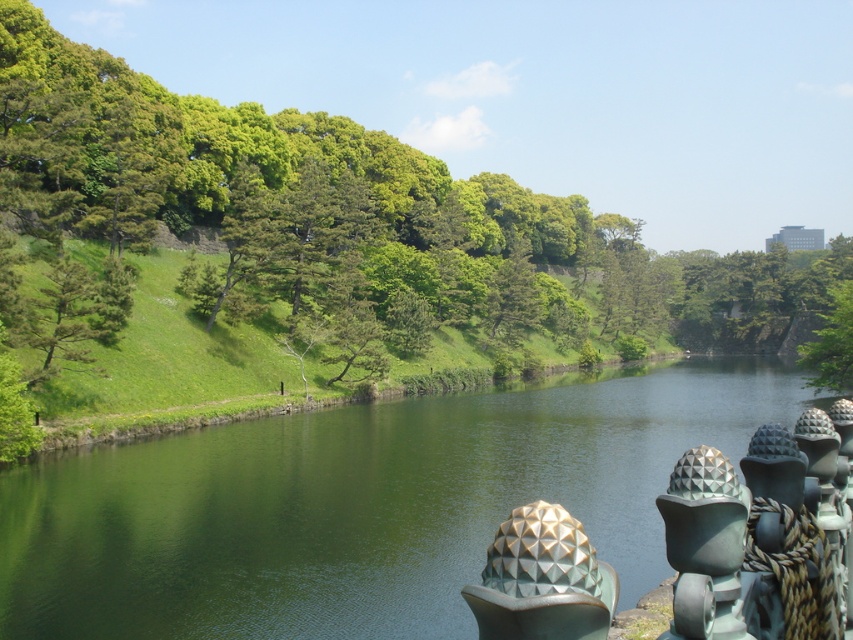
Question: Is green smooth water at center behind polished bronze sphere at lower right?

Choices:
 (A) yes
 (B) no

Answer: (A)

Question: Does green smooth water at center lie in front of green leafy tree at center-right?

Choices:
 (A) no
 (B) yes

Answer: (B)

Question: Which object appears closest to the camera in this image?

Choices:
 (A) polished bronze sphere at lower right
 (B) green leafy tree at center

Answer: (A)

Question: Among these objects, which one is nearest to the camera?

Choices:
 (A) green leafy tree at center
 (B) polished bronze sphere at lower right

Answer: (B)

Question: Is green smooth water at center thinner than polished bronze sphere at lower right?

Choices:
 (A) no
 (B) yes

Answer: (A)

Question: Considering the real-world distances, which object is closest to the green leafy tree at center-right?

Choices:
 (A) polished bronze sphere at lower right
 (B) green leafy tree at center

Answer: (B)